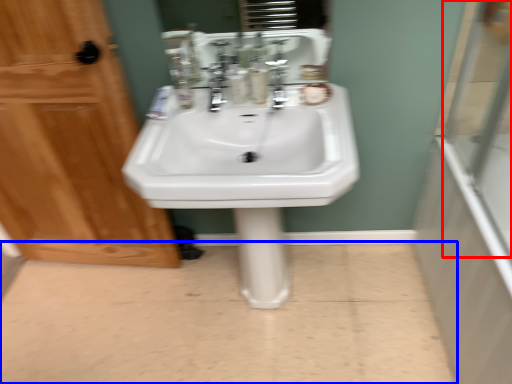
Question: Which object appears farthest to the camera in this image, glass door (highlighted by a red box) or plain (highlighted by a blue box)?

Choices:
 (A) glass door
 (B) plain

Answer: (B)